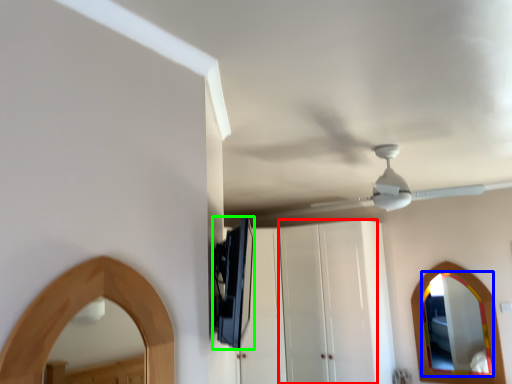
Question: Estimate the real-world distances between objects in this image. Which object is closer to glass door (highlighted by a red box), mirror (highlighted by a blue box) or appliance (highlighted by a green box)?

Choices:
 (A) mirror
 (B) appliance

Answer: (A)